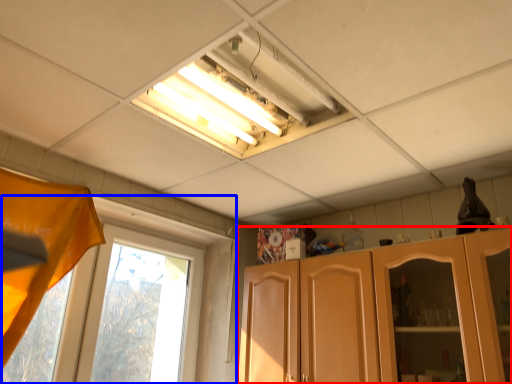
Question: Which object appears farthest to the camera in this image, cabinetry (highlighted by a red box) or window (highlighted by a blue box)?

Choices:
 (A) cabinetry
 (B) window

Answer: (B)